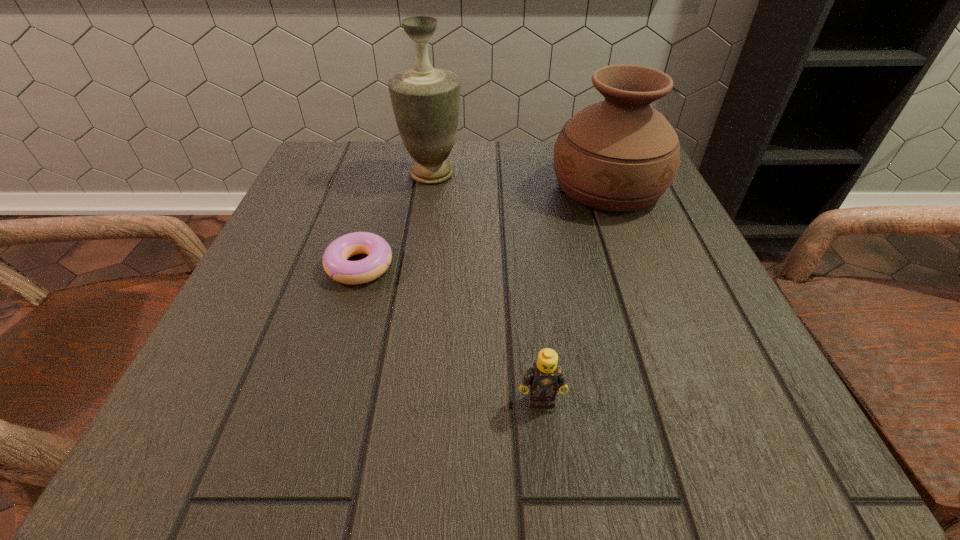
Locate an element on the screen. the tallest object is located at coordinates (425, 100).

The image size is (960, 540). In order to click on the left urn in this screenshot , I will do `click(425, 100)`.

The width and height of the screenshot is (960, 540). Find the location of `the third shortest object`. the third shortest object is located at coordinates (620, 154).

Where is `the shorter urn`? The width and height of the screenshot is (960, 540). the shorter urn is located at coordinates (620, 154).

Locate an element on the screen. Image resolution: width=960 pixels, height=540 pixels. the second object from right to left is located at coordinates (544, 376).

Identify the location of the nearest object. (544, 376).

You are a GUI agent. You are given a task and a screenshot of the screen. Output one action in this format:
    pyautogui.click(x=<x>, y=<y>)
    Task: Click on the shortest object
    This screenshot has height=540, width=960.
    Given the screenshot: What is the action you would take?
    pyautogui.click(x=335, y=263)

I want to click on the second nearest object, so click(335, 263).

This screenshot has width=960, height=540. Find the location of `free space located on the right of the left urn`. free space located on the right of the left urn is located at coordinates (551, 173).

Where is `blank space located 0.400m on the left of the second tallest object`? The height and width of the screenshot is (540, 960). blank space located 0.400m on the left of the second tallest object is located at coordinates (356, 187).